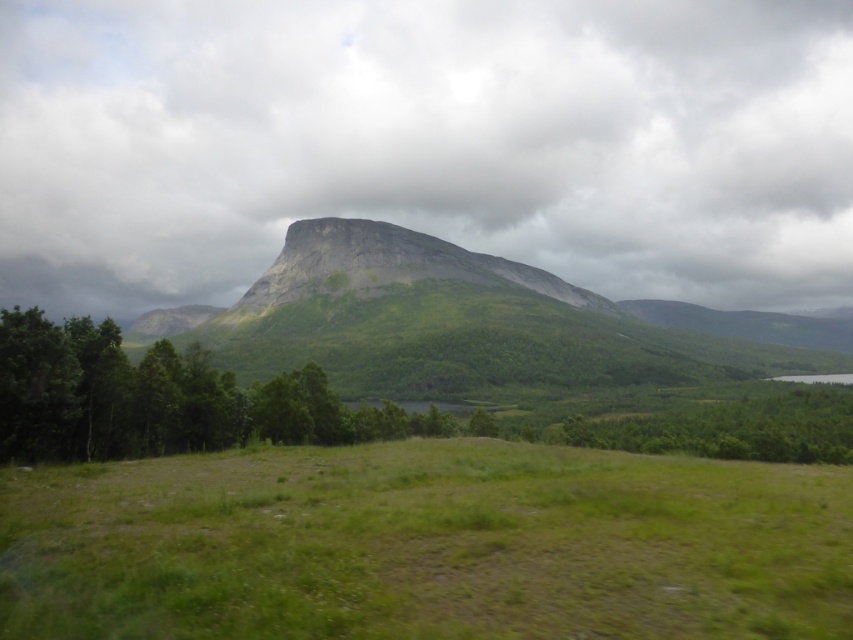
Who is higher up, cloudy gray rock at upper center or green grassy mountain at center?

cloudy gray rock at upper center

Does cloudy gray rock at upper center lie in front of green grassy mountain at center?

No, cloudy gray rock at upper center is further to the viewer.

This screenshot has width=853, height=640. Describe the element at coordinates (426, 144) in the screenshot. I see `cloudy gray rock at upper center` at that location.

This screenshot has height=640, width=853. What are the coordinates of `cloudy gray rock at upper center` in the screenshot? It's located at (426, 144).

Where is `cloudy gray rock at upper center`? cloudy gray rock at upper center is located at coordinates (426, 144).

Between point (160, 211) and point (807, 422), which one is positioned behind?

The point (160, 211) is more distant.

This screenshot has width=853, height=640. Identify the location of cloudy gray rock at upper center. (426, 144).

Can you confirm if cloudy gray rock at upper center is positioned above green rock mountain at center?

Indeed, cloudy gray rock at upper center is positioned over green rock mountain at center.

The height and width of the screenshot is (640, 853). Identify the location of cloudy gray rock at upper center. (426, 144).

What do you see at coordinates (426, 144) in the screenshot?
I see `cloudy gray rock at upper center` at bounding box center [426, 144].

Locate an element on the screen. cloudy gray rock at upper center is located at coordinates (426, 144).